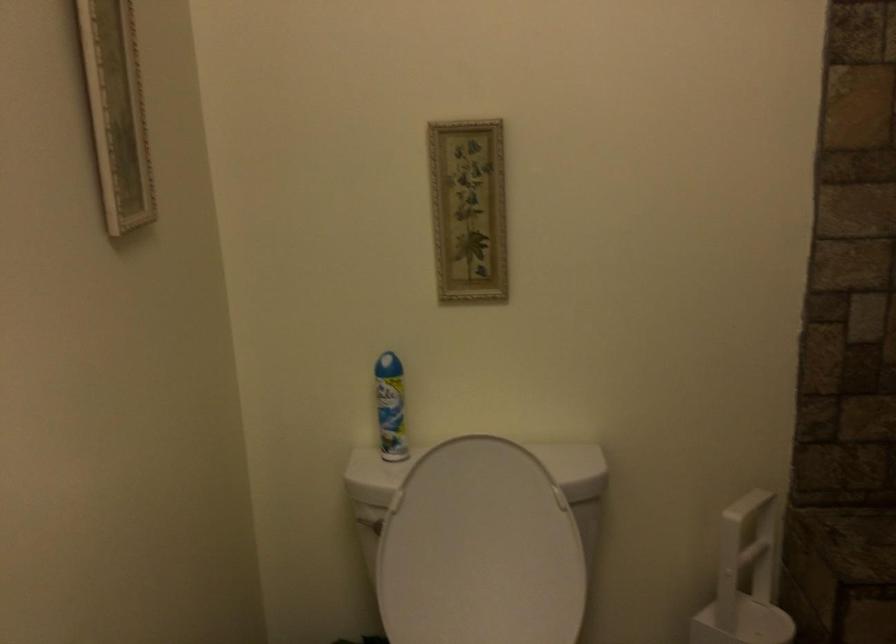
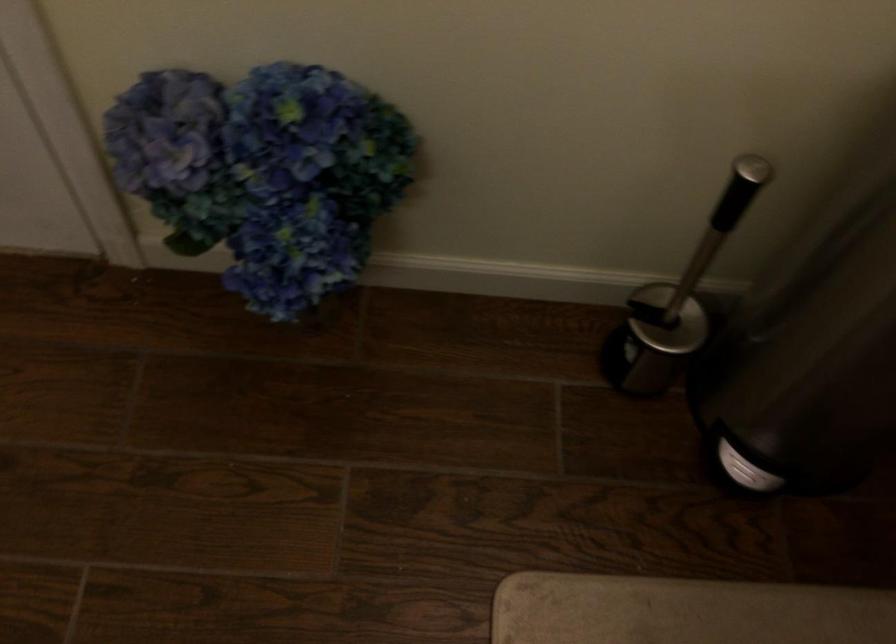
Based on the continuous images, in which direction is the camera rotating?

The camera rotated toward left-down.